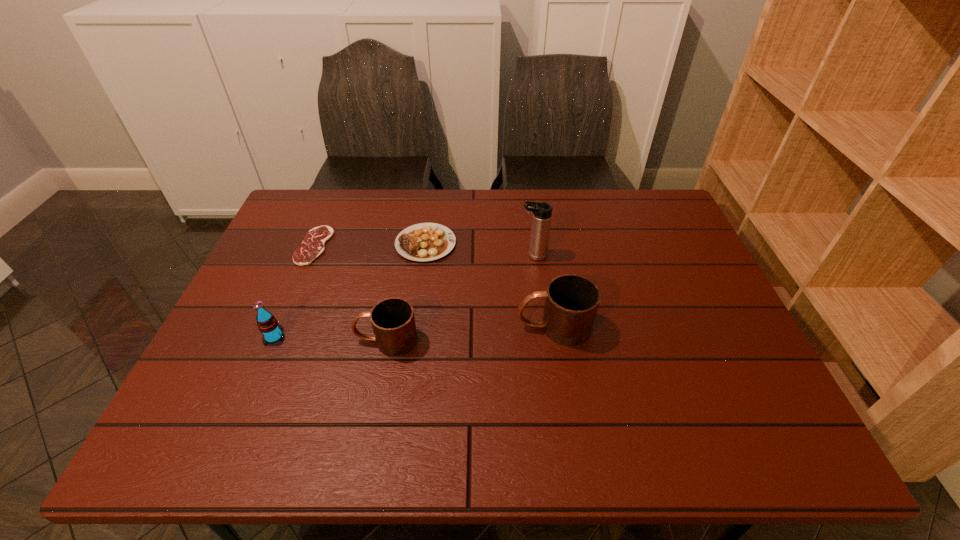
Where is `the shorter mug`? The image size is (960, 540). the shorter mug is located at coordinates (393, 322).

Where is `the fourth tallest object`? The width and height of the screenshot is (960, 540). the fourth tallest object is located at coordinates (393, 322).

You are a GUI agent. You are given a task and a screenshot of the screen. Output one action in this format:
    pyautogui.click(x=<x>, y=<y>)
    Task: Click on the taller mug
    Image resolution: width=960 pixels, height=540 pixels.
    Given the screenshot: What is the action you would take?
    pyautogui.click(x=571, y=301)

Where is `the shorter steak`? the shorter steak is located at coordinates (313, 245).

Locate an element on the screen. the left steak is located at coordinates (313, 245).

Locate an element on the screen. The image size is (960, 540). the fifth tallest object is located at coordinates (422, 242).

At what (x,y) coordinates should I click in order to perform the action: click on the taller steak. Please return your answer as a coordinate pair (x, y). Looking at the image, I should click on (422, 242).

Locate an element on the screen. the tallest object is located at coordinates (542, 212).

Where is `soda`? This screenshot has height=540, width=960. soda is located at coordinates (267, 324).

I want to click on vacant space located on the side of the fourth tallest object with the handle, so click(x=240, y=340).